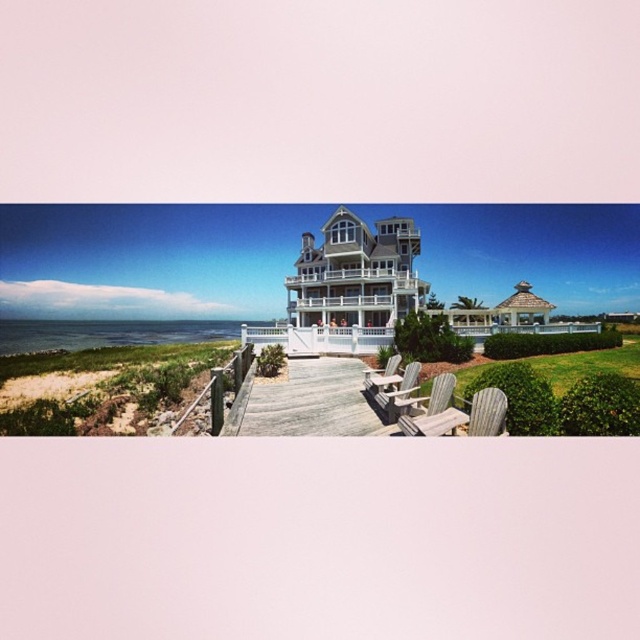
Question: In this image, where is wooden textured beach chair at lower right located relative to wooden beach chair at lower center?

Choices:
 (A) right
 (B) left

Answer: (A)

Question: Is wooden beach chair at center positioned in front of wooden beach chair at lower center?

Choices:
 (A) no
 (B) yes

Answer: (B)

Question: Which of the following is the farthest from the observer?

Choices:
 (A) light gray wooden beach chair at lower center
 (B) wooden beach chair at center
 (C) wooden textured beach chair at lower right

Answer: (A)

Question: Which is farther from the wooden beach chair at lower center?

Choices:
 (A) wooden textured beach chair at lower right
 (B) wooden beach chair at center

Answer: (A)

Question: Does wooden beach chair at center appear on the right side of light gray wooden beach chair at lower center?

Choices:
 (A) yes
 (B) no

Answer: (B)

Question: Which point is farther from the camera taking this photo?

Choices:
 (A) (387, 371)
 (B) (493, 435)
 (C) (454, 420)
 (D) (410, 396)

Answer: (A)